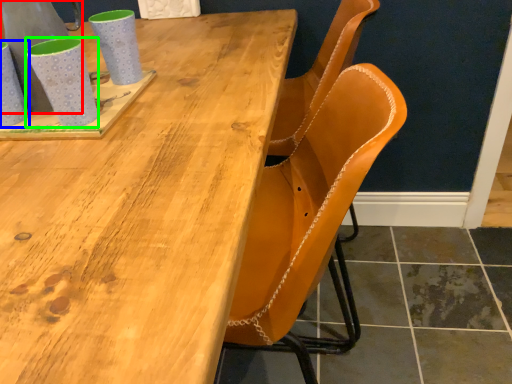
Question: Which object is positioned closest to gray (highlighted by a red box)? Select from mug (highlighted by a blue box) and mug (highlighted by a green box).

Choices:
 (A) mug
 (B) mug

Answer: (A)